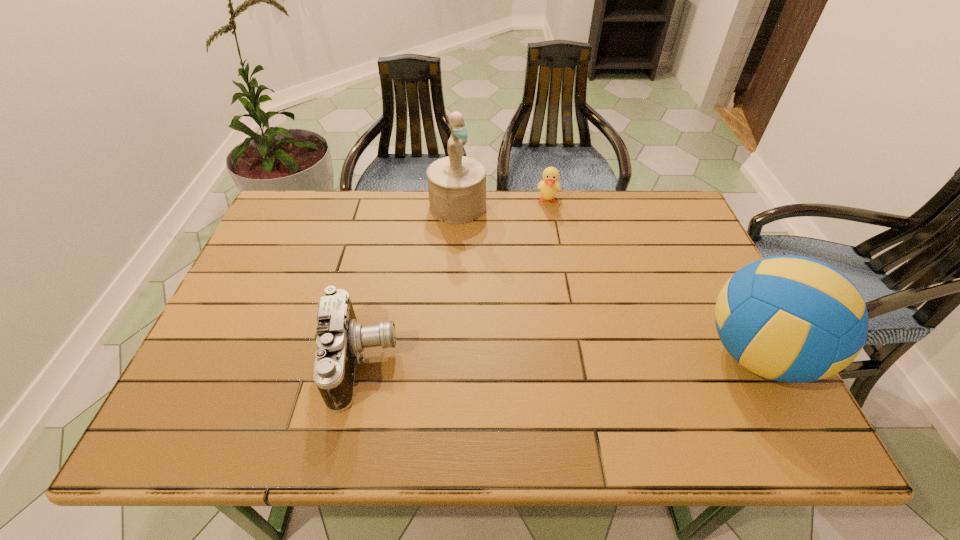
Locate an element on the screen. The image size is (960, 540). free space at the far edge of the desktop is located at coordinates (418, 208).

The width and height of the screenshot is (960, 540). I want to click on free space at the near edge, so click(575, 387).

Image resolution: width=960 pixels, height=540 pixels. Find the location of `free location at the left edge`. free location at the left edge is located at coordinates (269, 284).

Find the location of `vacant area at the right edge`. vacant area at the right edge is located at coordinates (683, 315).

Where is `vacant space at the far left corner of the desktop`? vacant space at the far left corner of the desktop is located at coordinates (268, 228).

Locate an element on the screen. The width and height of the screenshot is (960, 540). vacant space at the far right corner of the desktop is located at coordinates (655, 235).

In the image, there is a desktop. Where is `vacant space at the near right corner`? Image resolution: width=960 pixels, height=540 pixels. vacant space at the near right corner is located at coordinates [776, 394].

The image size is (960, 540). I want to click on empty space that is in between the volleyball and the figurine, so click(x=608, y=280).

Where is `free spot between the rightmost object and the third object from left to right`? The image size is (960, 540). free spot between the rightmost object and the third object from left to right is located at coordinates (653, 278).

This screenshot has height=540, width=960. Find the location of `free point between the leftmost object and the figurine`. free point between the leftmost object and the figurine is located at coordinates (410, 284).